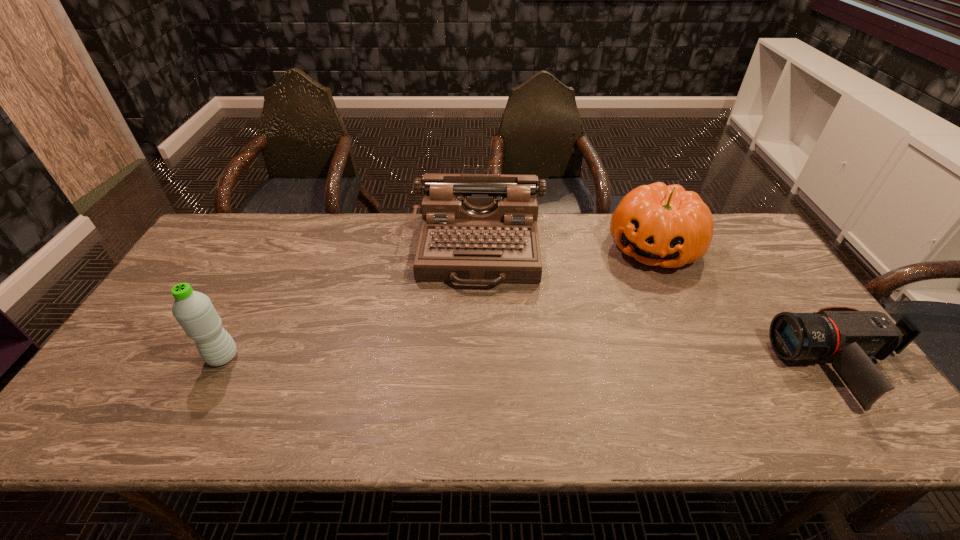
Locate an element on the screen. free space on the desktop that is between the leftmost object and the rightmost object and is positioned on the keyboard of the third object from right to left is located at coordinates (474, 361).

Find the location of a particular element. The image size is (960, 540). vacant space on the desktop that is between the leftmost object and the camcorder and is positioned on the carved face of the second object from right to left is located at coordinates click(596, 363).